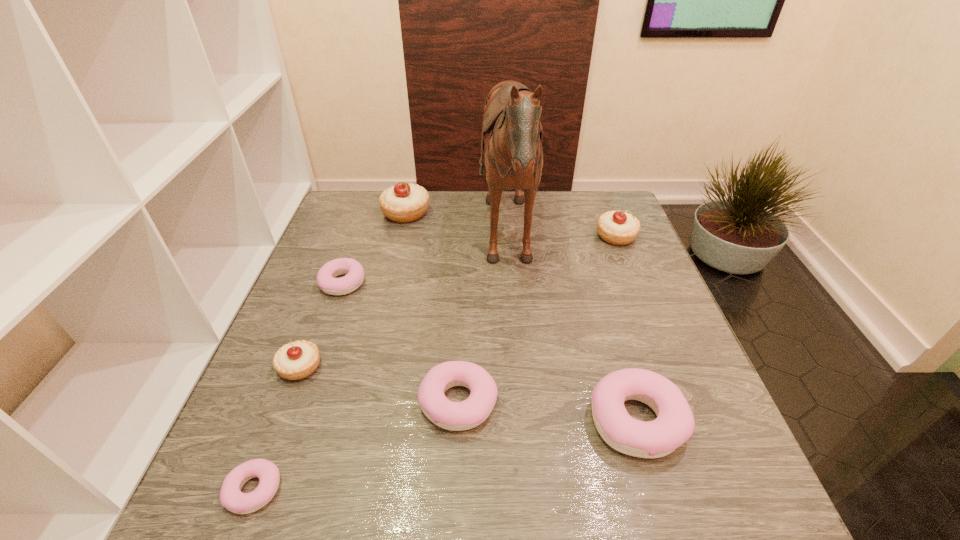
Where is `vacant area at the far edge of the desktop`? The width and height of the screenshot is (960, 540). vacant area at the far edge of the desktop is located at coordinates (557, 211).

Find the location of a particular element. This screenshot has width=960, height=540. vacant space at the near edge of the desktop is located at coordinates (456, 509).

Where is `blank space at the left edge of the desktop`? The image size is (960, 540). blank space at the left edge of the desktop is located at coordinates pos(279,451).

Locate an element on the screen. free spot at the right edge of the desktop is located at coordinates (635, 247).

Where is `blank space at the far left corner of the desktop`? This screenshot has height=540, width=960. blank space at the far left corner of the desktop is located at coordinates (374, 218).

In order to click on vacant space that is in between the tallest object and the third farthest pastry in this screenshot , I will do pos(425,264).

Locate an element on the screen. The height and width of the screenshot is (540, 960). vacant region between the sixth tallest object and the second tallest object is located at coordinates (432, 308).

Where is `empty space between the sixth tallest pastry and the biggest pink pastry`? The image size is (960, 540). empty space between the sixth tallest pastry and the biggest pink pastry is located at coordinates (490, 352).

You are a GUI agent. You are given a task and a screenshot of the screen. Output one action in this format:
    pyautogui.click(x=<x>, y=<y>)
    Task: Click on the unoccupied area between the seventh shortest object and the tallest object
    
    Given the screenshot: What is the action you would take?
    pyautogui.click(x=457, y=228)

In order to click on free spot between the tallest object and the smallest beige pastry in this screenshot , I will do `click(404, 306)`.